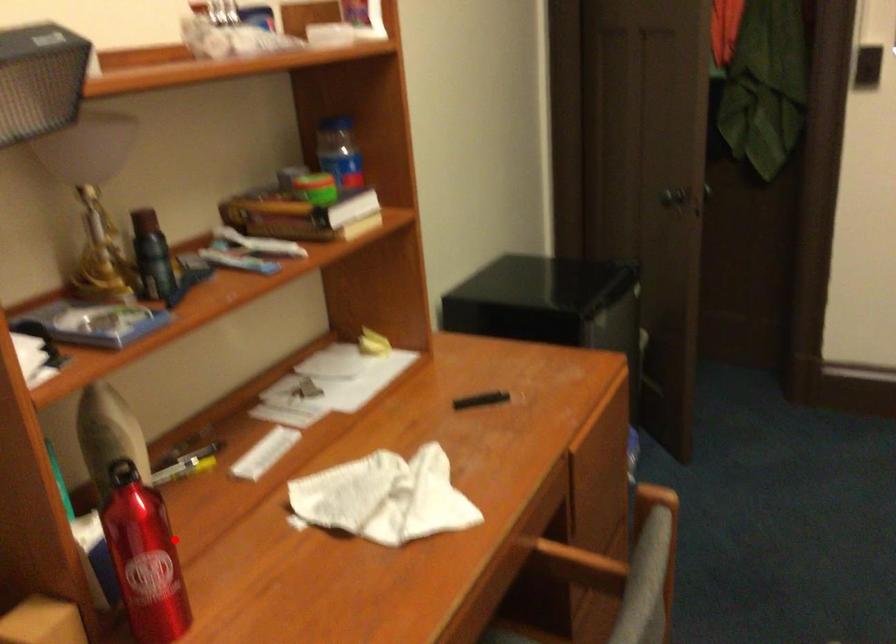
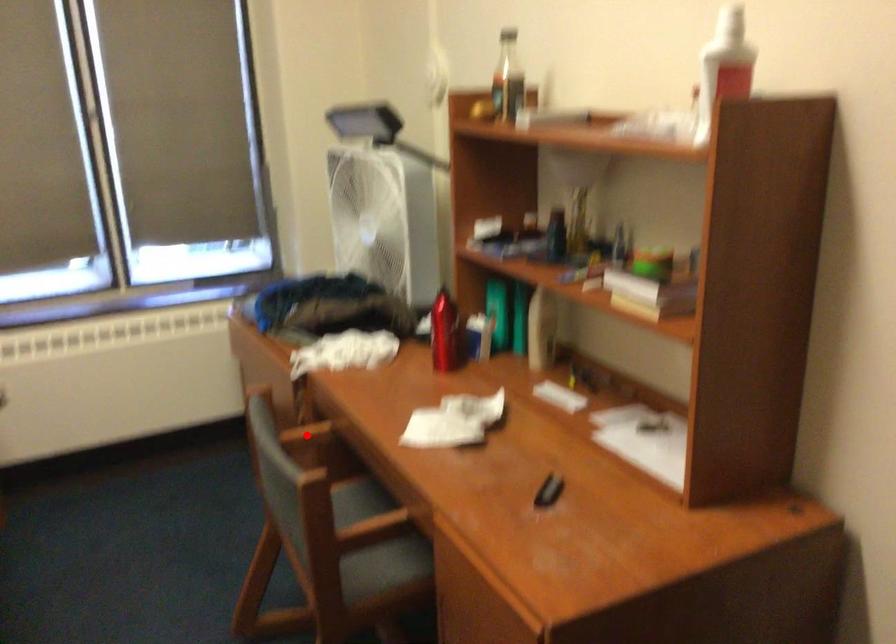
I am providing you with two images of the same scene from different viewpoints. A red point is marked on the first image and another point is marked on the second image. Are the points marked in image1 and image2 representing the same 3D position?

No